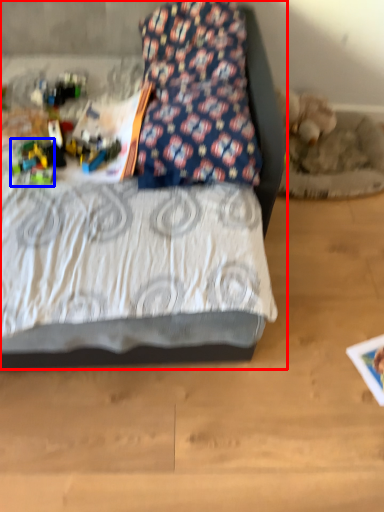
Question: Which of the following is the closest to the observer, bed (highlighted by a red box) or toy (highlighted by a blue box)?

Choices:
 (A) bed
 (B) toy

Answer: (A)